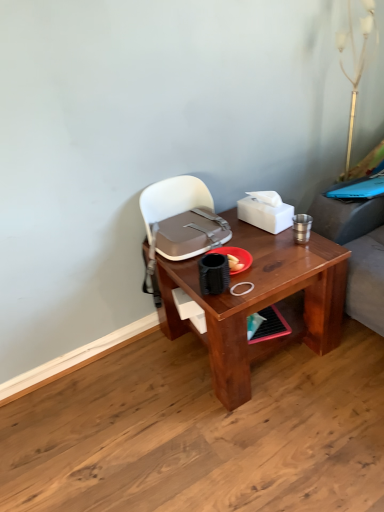
This screenshot has height=512, width=384. Identify the location of vacant space situated on the left part of white matte tissue box at upper right. (237, 226).